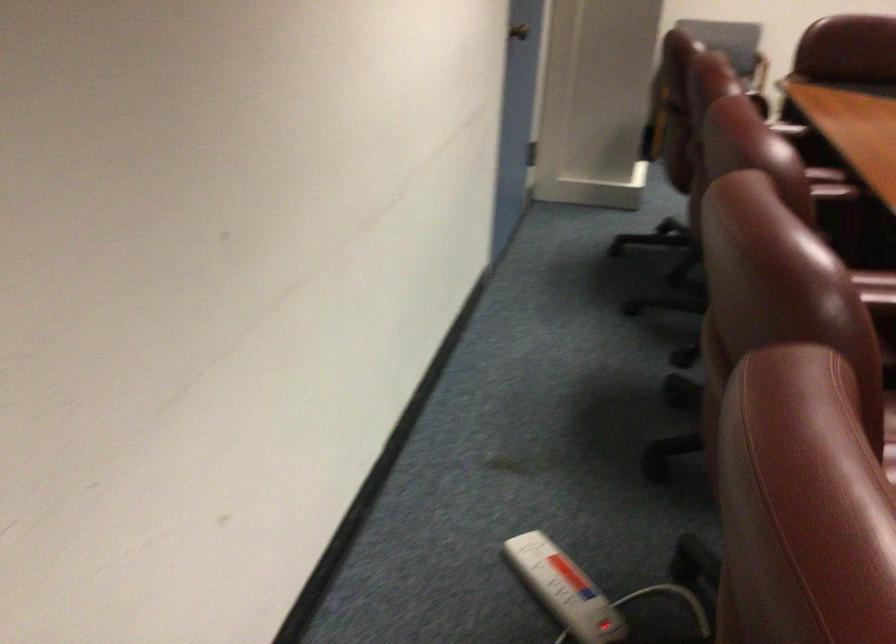
Where would you sit the brown leather sitting surface? Please return your answer as a coordinate pair (x, y).

(890, 438)